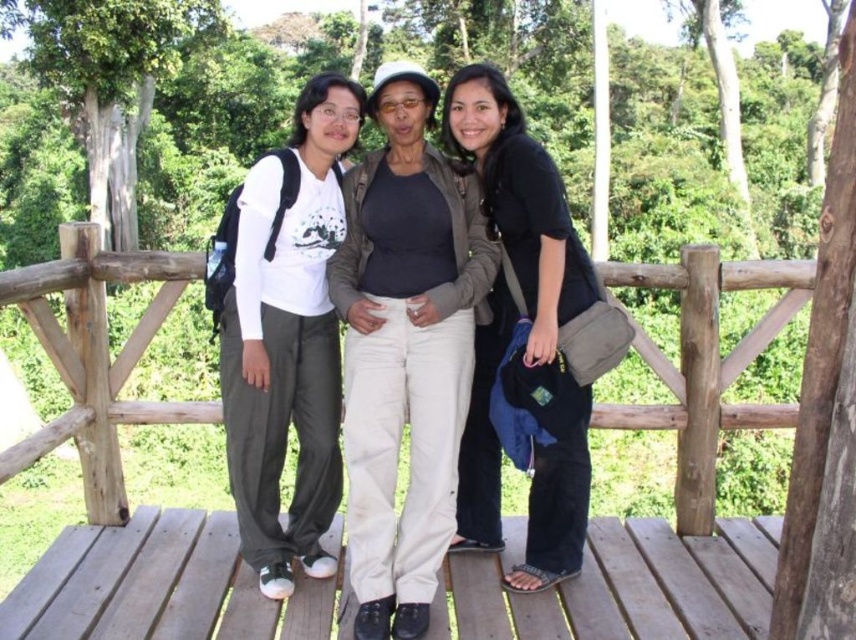
Is wooden bridge at center bigger than black matte shirt at center?

Actually, wooden bridge at center might be smaller than black matte shirt at center.

Does wooden bridge at center appear under black matte shirt at center?

Yes, wooden bridge at center is below black matte shirt at center.

Which is in front, point (86, 276) or point (536, 570)?

Point (536, 570)

Locate an element on the screen. wooden bridge at center is located at coordinates (120, 476).

Does wooden deck at center have a smaller size compared to light beige pants at center?

Yes, wooden deck at center is smaller than light beige pants at center.

Where is `wooden deck at center`? wooden deck at center is located at coordinates (623, 586).

Locate an element on the screen. Image resolution: width=856 pixels, height=640 pixels. wooden deck at center is located at coordinates (623, 586).

This screenshot has height=640, width=856. What are the coordinates of `wooden deck at center` in the screenshot? It's located at (623, 586).

Which is more to the left, matte white shirt at center or black matte shirt at center?

Positioned to the left is matte white shirt at center.

Can you confirm if matte white shirt at center is shorter than black matte shirt at center?

Incorrect, matte white shirt at center's height does not fall short of black matte shirt at center's.

This screenshot has height=640, width=856. Find the location of `matte white shirt at center`. matte white shirt at center is located at coordinates (288, 340).

In order to click on matte white shirt at center in this screenshot , I will do `click(288, 340)`.